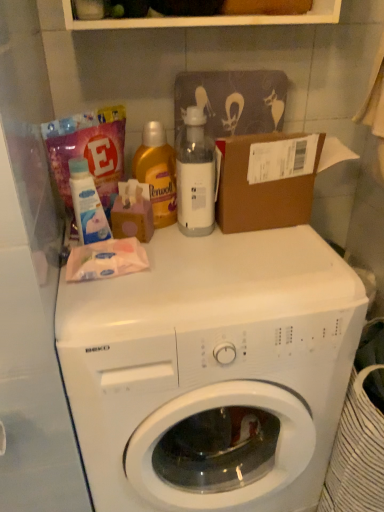
Question: Considering the relative positions of pink polka dot tissue box at upper center and white glossy washing machine at center in the image provided, is pink polka dot tissue box at upper center to the left or to the right of white glossy washing machine at center?

Choices:
 (A) left
 (B) right

Answer: (A)

Question: In terms of height, does pink polka dot tissue box at upper center look taller or shorter compared to white glossy washing machine at center?

Choices:
 (A) short
 (B) tall

Answer: (A)

Question: Estimate the real-world distances between objects in this image. Which object is farther from the yellow liquid detergent at upper center, which appears as the first cleaning product when viewed from the right?

Choices:
 (A) white plastic bottle at center
 (B) white glossy lotion at upper left, the 1th cleaning product in the left-to-right sequence
 (C) white glossy washing machine at center
 (D) pink polka dot tissue box at upper center

Answer: (C)

Question: Which object is the closest to the white glossy lotion at upper left, the 1th cleaning product in the left-to-right sequence?

Choices:
 (A) pink polka dot tissue box at upper center
 (B) white plastic bottle at center
 (C) yellow liquid detergent at upper center, which appears as the first cleaning product when viewed from the right
 (D) white glossy washing machine at center

Answer: (A)